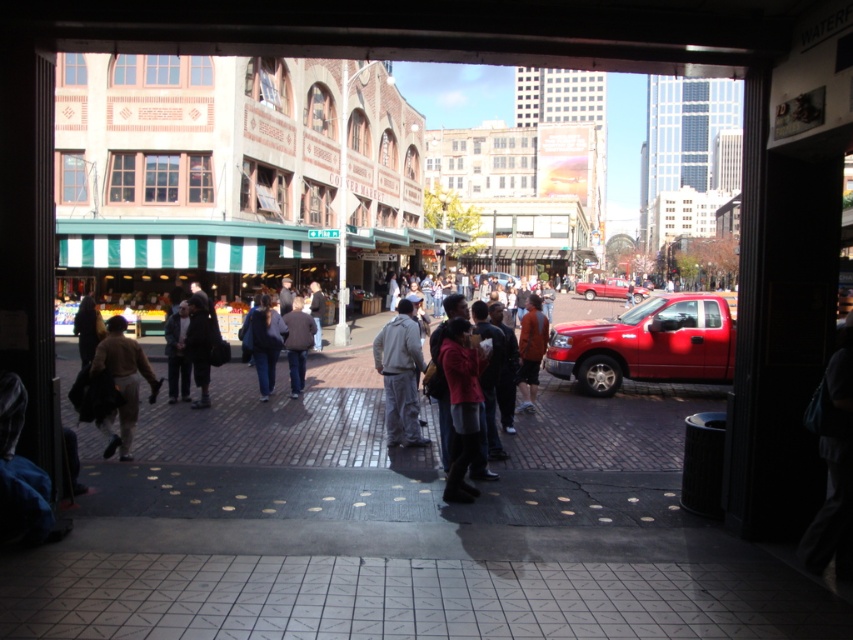
Based on the photo, you are a delivery person carrying a package and need to place it on the gray fabric jacket at center. However, there is a metallic red truck at center in the way. Can you place the package on the jacket without moving the truck?

The gray fabric jacket at center is positioned under the metallic red truck at center, so the truck is blocking access to the jacket. You cannot place the package there without moving the truck.

From the picture: You are a tailor who needs to determine which jacket to alter first. You have a dark gray jacket at center and a dark brown leather jacket at center. Which jacket requires more space on the tailor table due to its larger size?

The dark brown leather jacket at center requires more space on the tailor table because it has a greater width than the dark gray jacket at center.

You are a fashion designer observing a busy street scene. You notice a red matte jacket at center and an orange cotton shirt at center. Which clothing item takes up more space in the scene?

The orange cotton shirt at center occupies more space than the red matte jacket at center.